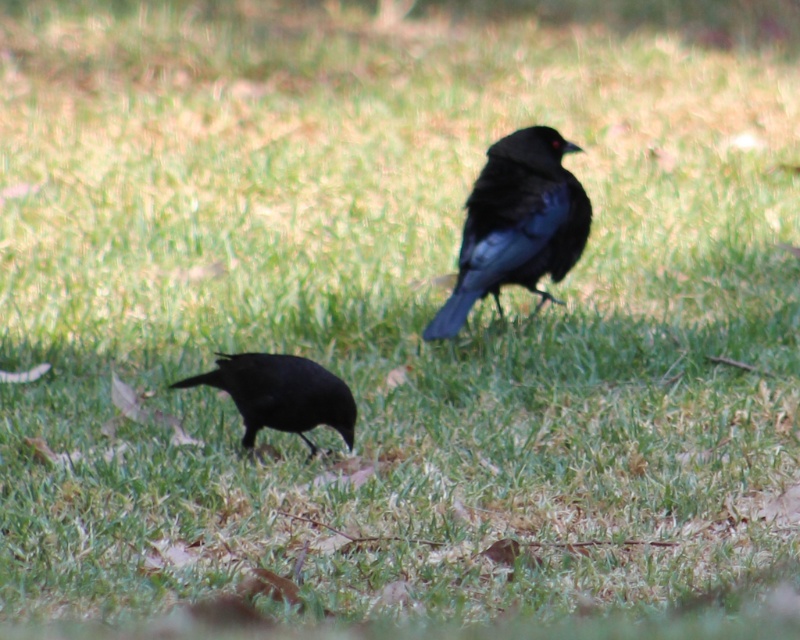
Question: Does shiny black crow at upper right have a smaller size compared to shiny black crow at lower left?

Choices:
 (A) yes
 (B) no

Answer: (B)

Question: Can you confirm if shiny black crow at upper right is positioned below shiny black crow at lower left?

Choices:
 (A) yes
 (B) no

Answer: (B)

Question: Which point is farther from the camera taking this photo?

Choices:
 (A) (528, 141)
 (B) (304, 397)

Answer: (A)

Question: Observing the image, what is the correct spatial positioning of shiny black crow at upper right in reference to shiny black crow at lower left?

Choices:
 (A) left
 (B) right

Answer: (B)